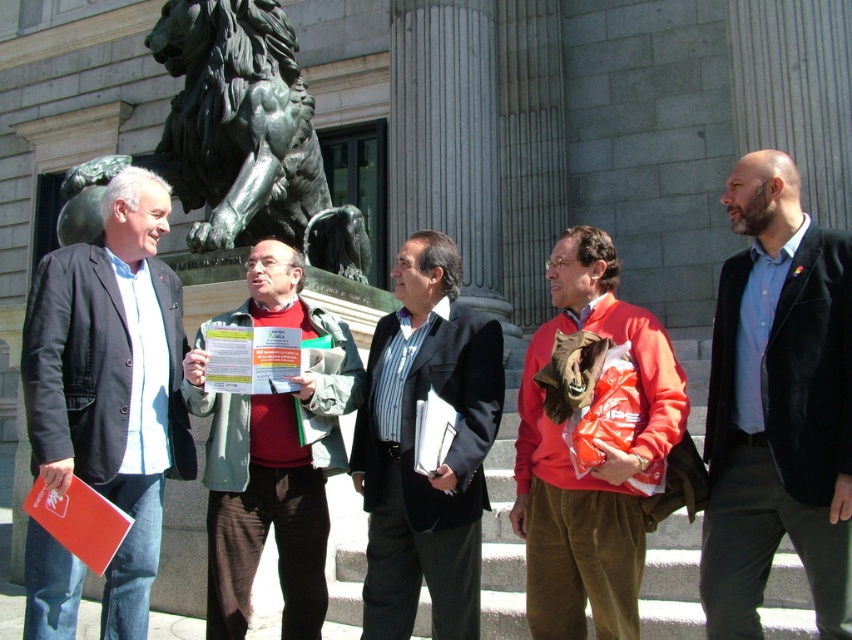
Consider the image. You are a photographer trying to capture a group photo of the blue cotton shirt at center and the striped fabric shirt at center. Since you want to ensure both shirts are visible in the frame, which shirt should you adjust your camera angle to focus on to account for their sizes?

The blue cotton shirt at center is narrower than the striped fabric shirt at center, so you should focus on the striped fabric shirt at center to ensure it fits properly in the frame.

You are a photographer standing 10 meters away from the blue cotton shirt at center and the matte black jacket at left. You want to take a photo that includes both of them in the frame. Given their distance apart, is it possible to capture both in a single shot without moving your position?

The blue cotton shirt at center and matte black jacket at left are 12.75 meters apart from each other. Since you are 10 meters away from both, the total distance between them exceeds your camera angle, making it impossible to capture both in a single frame without moving.

You are a photographer standing 3 meters away from the group. You want to take a photo that includes both the matte black jacket at left and the red sweater at center. Is there enough space between them to fit both in the frame without moving closer?

The distance between the matte black jacket at left and the red sweater at center is 2.35 meters. Since you are 3 meters away, the angle of view of most cameras would allow both subjects to fit within the frame without needing to move closer.